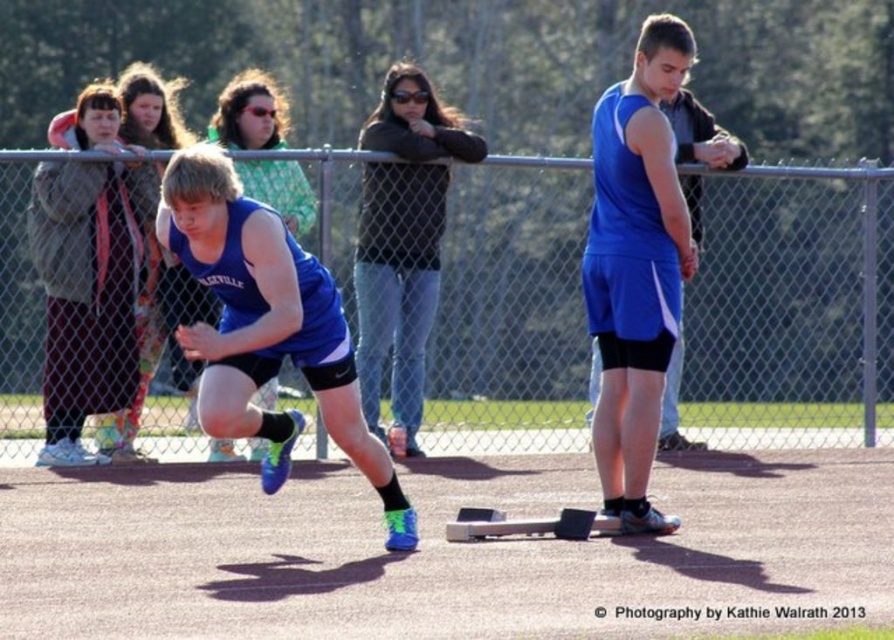
Which is above, blue matte tank top at center or dark gray fleece jacket at left?

dark gray fleece jacket at left is above.

Which of these two, blue matte tank top at center or dark gray fleece jacket at left, stands shorter?

Standing shorter between the two is blue matte tank top at center.

Between point (375, 449) and point (63, 349), which one is positioned behind?

Positioned behind is point (63, 349).

In order to click on blue matte tank top at center in this screenshot , I will do `click(266, 326)`.

Is metal chain-link fence at upper center further to camera compared to dark brown sweater at center?

No, metal chain-link fence at upper center is closer to the viewer.

Does metal chain-link fence at upper center have a larger size compared to dark brown sweater at center?

Incorrect, metal chain-link fence at upper center is not larger than dark brown sweater at center.

Consider the image. Measure the distance between point (x=496, y=316) and camera.

They are 15.54 meters apart.

Where is `metal chain-link fence at upper center`? metal chain-link fence at upper center is located at coordinates (793, 308).

Can you confirm if blue matte shorts at center is wider than dark brown sweater at center?

No.

Can you confirm if blue matte shorts at center is shorter than dark brown sweater at center?

No.

Is point (596, 284) positioned in front of point (409, 64)?

That is True.

Locate an element on the screen. The image size is (894, 640). blue matte shorts at center is located at coordinates pos(637,266).